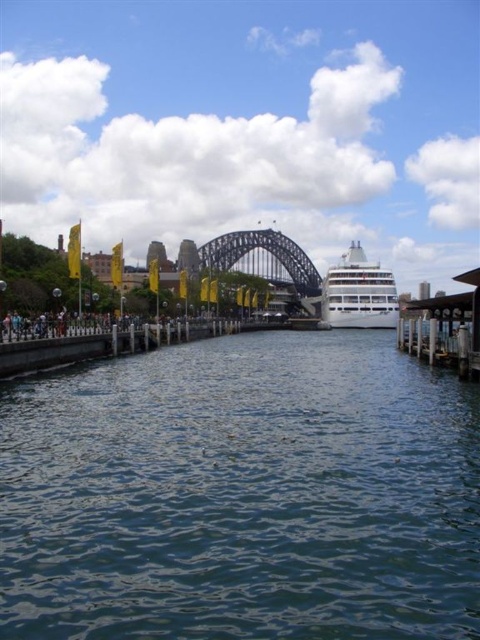
You are a tour guide explaining the Sydney Harbour Bridge. You see the blue water at center and the white glossy cruise ship at center. How far apart are they?

The distance between the blue water at center and the white glossy cruise ship at center is 242.03 feet.

You are standing at the point marked by the coordinates point [262,259] in the image. What object are you directly facing?

The point [262,259] marks the dark gray steel bridge at center, so you are directly facing the dark gray steel bridge at center.

You are standing at the waterfront at Circular Quay and see two points marked in the image. The first point is at coordinates point (x=280, y=250) and the second is at point (x=369, y=301). Which point is closer to you?

Point (x=280, y=250) is further to the viewer than point (x=369, y=301), so the second point is closer to you.